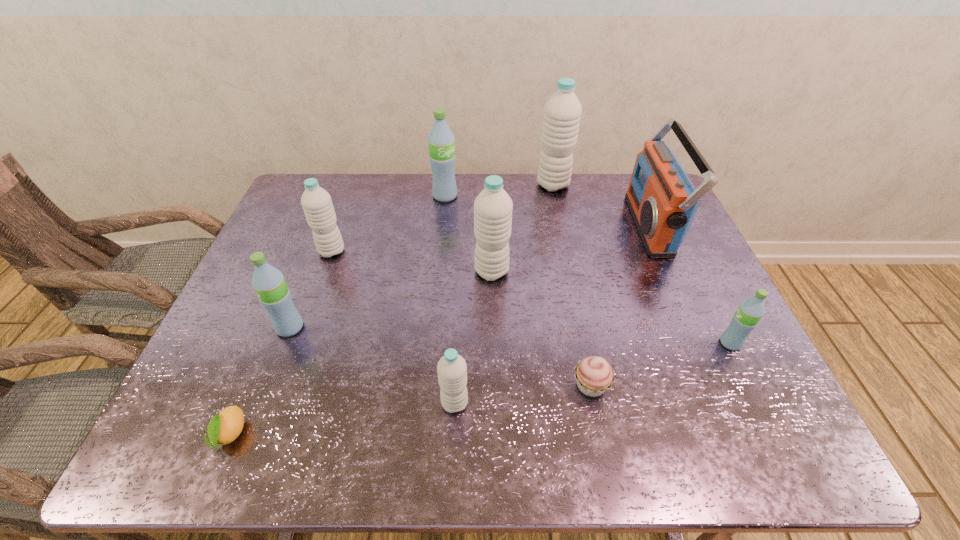
This screenshot has width=960, height=540. What are the coordinates of `object that can be found as the fifth closest to the cupcake` in the screenshot? It's located at (274, 294).

Find the location of a particular element. The height and width of the screenshot is (540, 960). water bottle that can be found as the fourth closest to the leftmost white water bottle is located at coordinates (452, 370).

Locate which water bottle ranks third in proximity to the third smallest white water bottle. Please provide its 2D coordinates. Your answer should be formatted as a tuple, i.e. [(x, y)], where the tuple contains the x and y coordinates of a point satisfying the conditions above.

[(562, 112)]

Where is `the third closest white water bottle to the second green water bottle from left to right`? the third closest white water bottle to the second green water bottle from left to right is located at coordinates (316, 202).

Select which white water bottle appears as the second closest to the radio receiver. Please provide its 2D coordinates. Your answer should be formatted as a tuple, i.e. [(x, y)], where the tuple contains the x and y coordinates of a point satisfying the conditions above.

[(493, 207)]

Identify which green water bottle is located as the nearest to the leftmost white water bottle. Please provide its 2D coordinates. Your answer should be formatted as a tuple, i.e. [(x, y)], where the tuple contains the x and y coordinates of a point satisfying the conditions above.

[(274, 294)]

The width and height of the screenshot is (960, 540). I want to click on green water bottle that is the closest to the cupcake, so click(745, 319).

The image size is (960, 540). I want to click on free space that satisfies the following two spatial constraints: 1. on the front side of the leftmost white water bottle; 2. on the right side of the fifth water bottle from left to right, so click(324, 272).

Locate an element on the screen. The image size is (960, 540). vacant space that satisfies the following two spatial constraints: 1. on the front side of the cupcake; 2. on the right side of the third white water bottle from left to right is located at coordinates (494, 386).